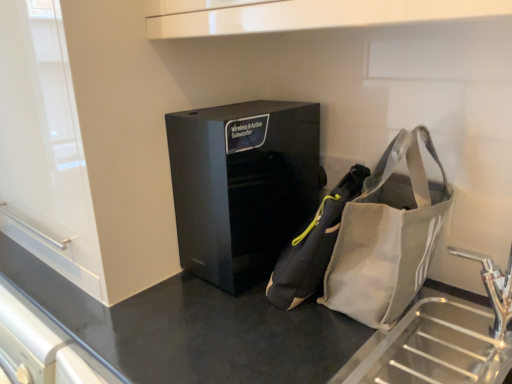
Question: From a real-world perspective, is black matte counter at center located beneath black glossy speaker at center?

Choices:
 (A) no
 (B) yes

Answer: (B)

Question: Is black matte counter at center oriented towards black glossy speaker at center?

Choices:
 (A) no
 (B) yes

Answer: (A)

Question: Would you say black matte counter at center contains black glossy speaker at center?

Choices:
 (A) no
 (B) yes

Answer: (A)

Question: Is the surface of black matte counter at center in direct contact with black glossy speaker at center?

Choices:
 (A) yes
 (B) no

Answer: (B)

Question: Is black matte counter at center shorter than black glossy speaker at center?

Choices:
 (A) no
 (B) yes

Answer: (A)

Question: Looking at the image, does gray fabric bag at lower right seem bigger or smaller compared to gray fabric pouch at center?

Choices:
 (A) small
 (B) big

Answer: (B)

Question: Choose the correct answer: Is gray fabric bag at lower right inside gray fabric pouch at center or outside it?

Choices:
 (A) inside
 (B) outside

Answer: (B)

Question: Is point (379, 286) closer or farther from the camera than point (306, 294)?

Choices:
 (A) farther
 (B) closer

Answer: (B)

Question: Is gray fabric bag at lower right taller or shorter than gray fabric pouch at center?

Choices:
 (A) short
 (B) tall

Answer: (B)

Question: Is black glossy speaker at center inside the boundaries of gray fabric pouch at center, or outside?

Choices:
 (A) inside
 (B) outside

Answer: (B)

Question: Looking at their shapes, would you say black glossy speaker at center is wider or thinner than gray fabric pouch at center?

Choices:
 (A) wide
 (B) thin

Answer: (A)

Question: From a real-world perspective, is black glossy speaker at center above or below gray fabric pouch at center?

Choices:
 (A) above
 (B) below

Answer: (A)

Question: Is point (249, 192) closer or farther from the camera than point (352, 185)?

Choices:
 (A) closer
 (B) farther

Answer: (B)

Question: Is black matte counter at center spatially inside black glossy speaker at center, or outside of it?

Choices:
 (A) inside
 (B) outside

Answer: (B)

Question: Based on their sizes in the image, would you say black matte counter at center is bigger or smaller than black glossy speaker at center?

Choices:
 (A) big
 (B) small

Answer: (A)